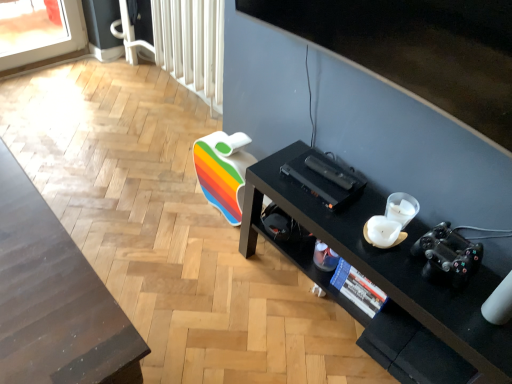
Question: From a real-world perspective, is black matte desk at lower right on white plastic radiator at upper center?

Choices:
 (A) yes
 (B) no

Answer: (B)

Question: Considering the relative sizes of black matte desk at lower right and white plastic radiator at upper center in the image provided, is black matte desk at lower right shorter than white plastic radiator at upper center?

Choices:
 (A) yes
 (B) no

Answer: (A)

Question: Does black matte desk at lower right have a greater width compared to white plastic radiator at upper center?

Choices:
 (A) yes
 (B) no

Answer: (A)

Question: Could white plastic radiator at upper center be considered to be inside black matte desk at lower right?

Choices:
 (A) no
 (B) yes

Answer: (A)

Question: From a real-world perspective, is black matte desk at lower right under white plastic radiator at upper center?

Choices:
 (A) yes
 (B) no

Answer: (A)

Question: In terms of width, does black matte video camera at lower right look wider or thinner when compared to white plastic radiator at upper center?

Choices:
 (A) wide
 (B) thin

Answer: (B)

Question: From a real-world perspective, is black matte video camera at lower right above or below white plastic radiator at upper center?

Choices:
 (A) above
 (B) below

Answer: (A)

Question: Is black matte video camera at lower right inside the boundaries of white plastic radiator at upper center, or outside?

Choices:
 (A) outside
 (B) inside

Answer: (A)

Question: In the image, is black matte video camera at lower right on the left side or the right side of white plastic radiator at upper center?

Choices:
 (A) right
 (B) left

Answer: (A)

Question: From a real-world perspective, relative to black matte desk at lower right, is black matte video camera at lower right vertically above or below?

Choices:
 (A) below
 (B) above

Answer: (B)

Question: Considering their positions, is black matte video camera at lower right located in front of or behind black matte desk at lower right?

Choices:
 (A) front
 (B) behind

Answer: (B)

Question: Is black matte video camera at lower right spatially inside black matte desk at lower right, or outside of it?

Choices:
 (A) outside
 (B) inside

Answer: (A)

Question: Is point (435, 268) positioned closer to the camera than point (482, 276)?

Choices:
 (A) closer
 (B) farther

Answer: (A)

Question: Do you think black matte desk at lower right is within black matte video camera at lower right, or outside of it?

Choices:
 (A) outside
 (B) inside

Answer: (A)

Question: Looking at their shapes, would you say black matte desk at lower right is wider or thinner than black matte video camera at lower right?

Choices:
 (A) thin
 (B) wide

Answer: (B)